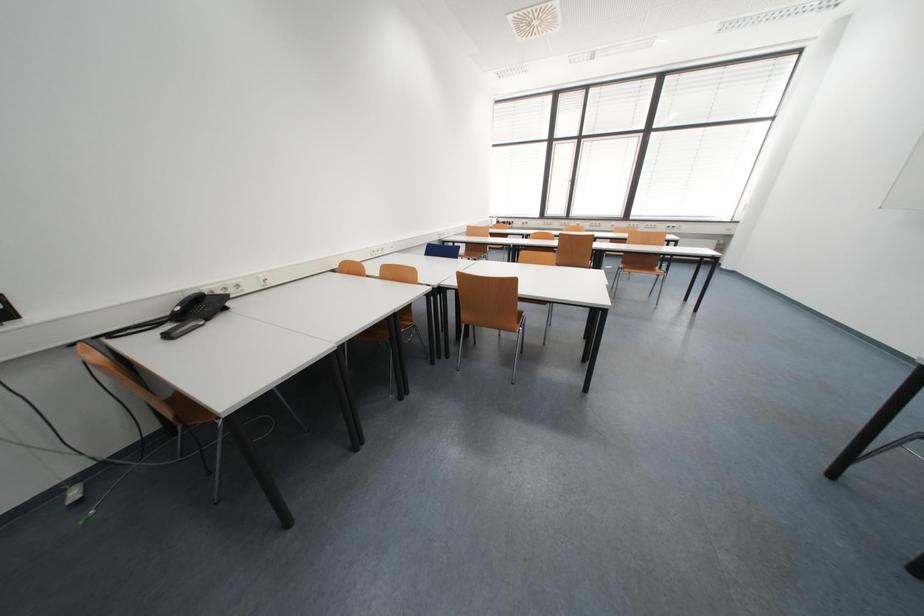
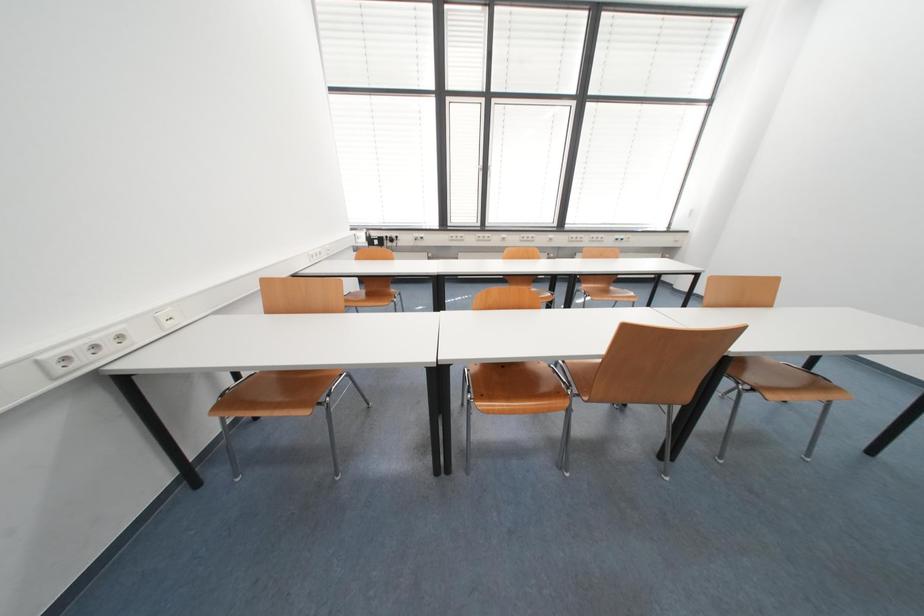
Question: The images are taken continuously from a first-person perspective. In which direction are you moving?

Choices:
 (A) Left
 (B) Right
 (C) Forward
 (D) Backward

Answer: (C)